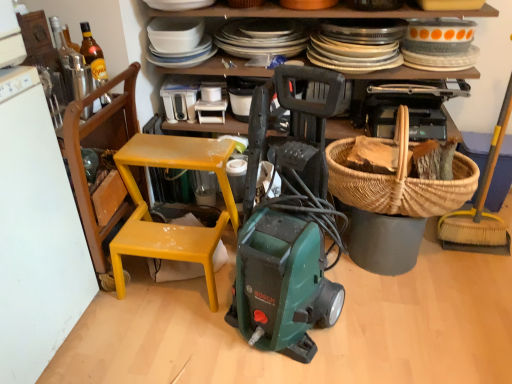
Question: Considering the positions of metallic glass bottle at upper left, marked as the 2th appliance in a back-to-front arrangement, and white plastic toaster at upper center, which is the 2th appliance in left-to-right order, in the image, is metallic glass bottle at upper left, marked as the 2th appliance in a back-to-front arrangement, bigger or smaller than white plastic toaster at upper center, which is the 2th appliance in left-to-right order,?

Choices:
 (A) small
 (B) big

Answer: (A)

Question: In terms of width, does metallic glass bottle at upper left, marked as the 2th appliance in a back-to-front arrangement, look wider or thinner when compared to white plastic toaster at upper center, placed as the second appliance when sorted from front to back?

Choices:
 (A) thin
 (B) wide

Answer: (A)

Question: Considering the real-world distances, which object is closest to the white glossy plates at upper center?

Choices:
 (A) metallic glass bottle at upper left, marked as the 1th appliance in a front-to-back arrangement
 (B) brown woven picnic basket at center right
 (C) wooden chair at left, acting as the 1th chair starting from the left
 (D) yellow plastic chair at left, the 1th chair when ordered from right to left
 (E) translucent glass bottle at upper left

Answer: (B)

Question: Which is farther from the metallic glass bottle at upper left, the second appliance from the right?

Choices:
 (A) white glossy plates at upper center
 (B) brown woven picnic basket at center right
 (C) white plastic toaster at upper center, which is the 2th appliance in left-to-right order
 (D) yellow plastic chair at left, the 1th chair when ordered from right to left
 (E) wooden chair at left, acting as the 1th chair starting from the left

Answer: (B)